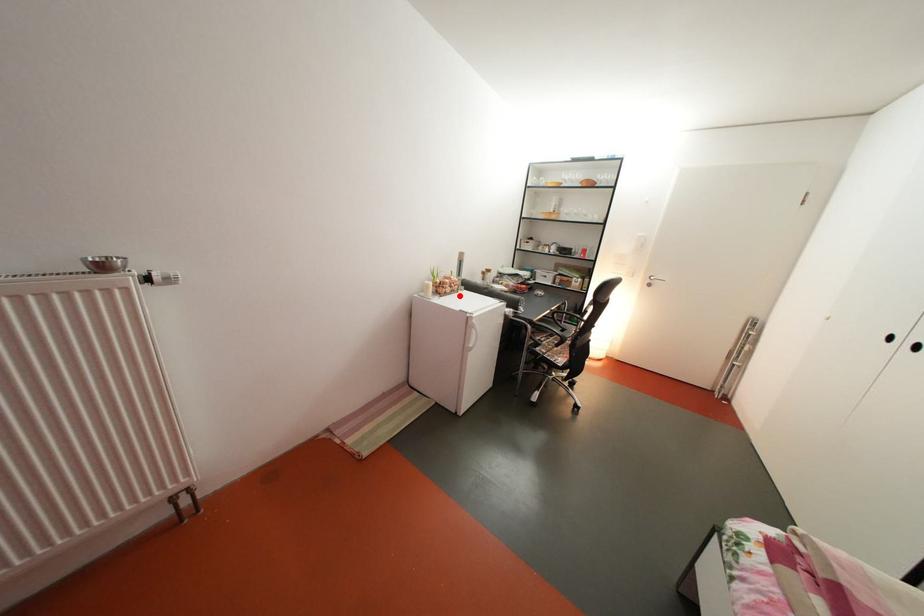
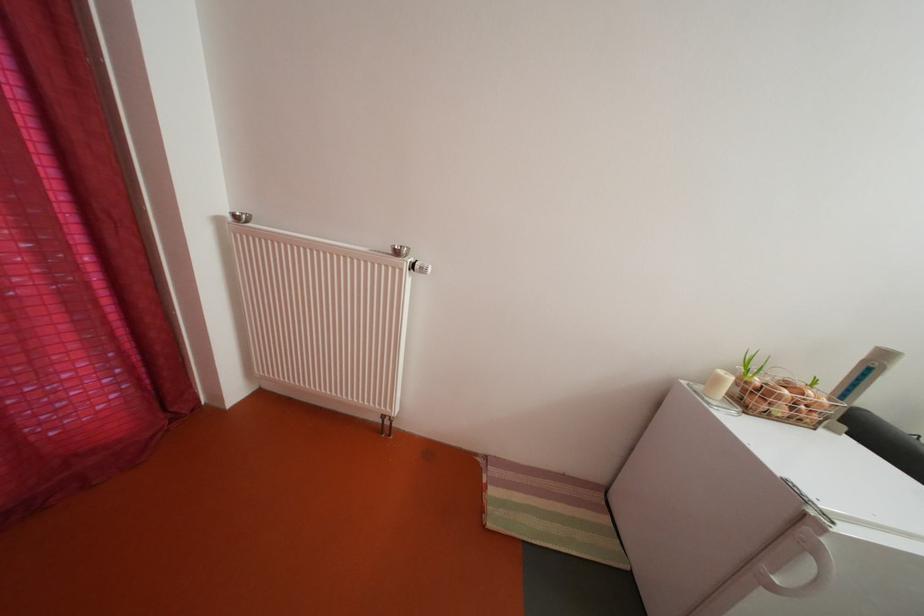
Locate, in the second image, the point that corresponds to the highlighted location in the first image.

(792, 416)